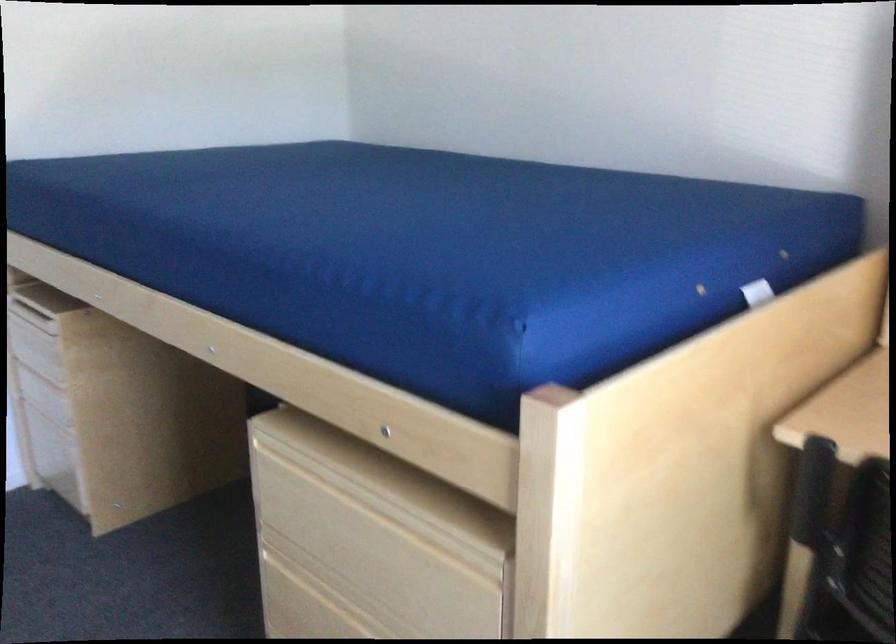
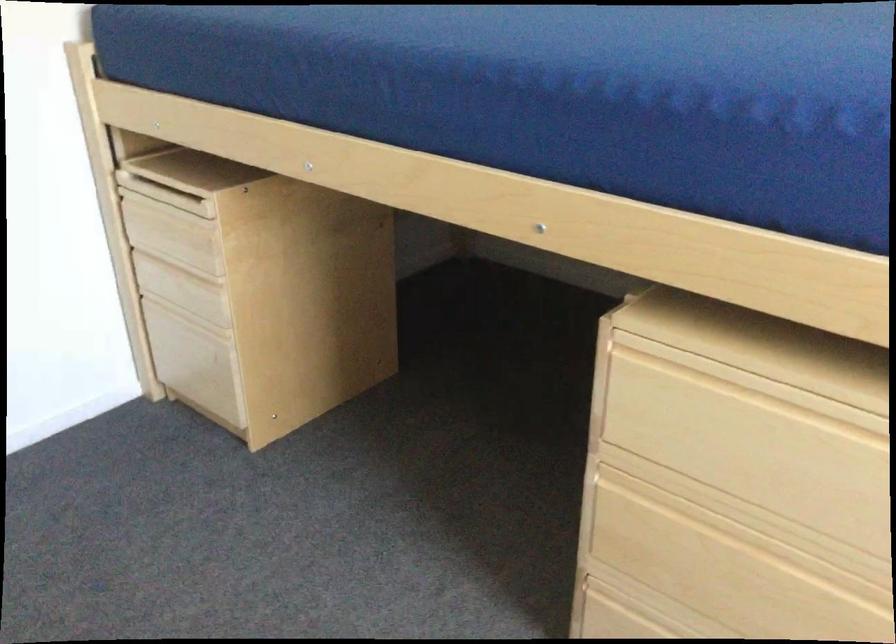
Locate, in the second image, the point that corresponds to [323,491] in the first image.

(743, 406)